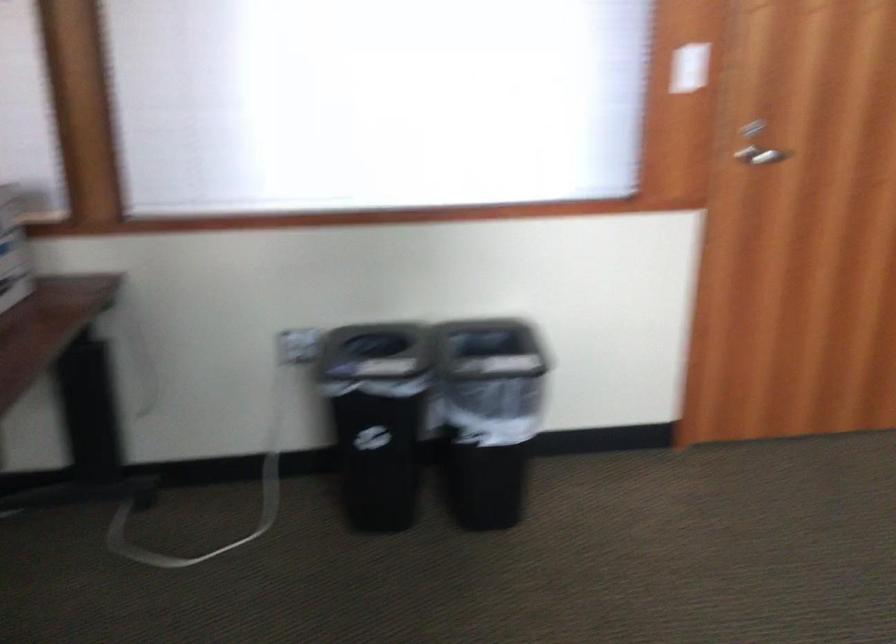
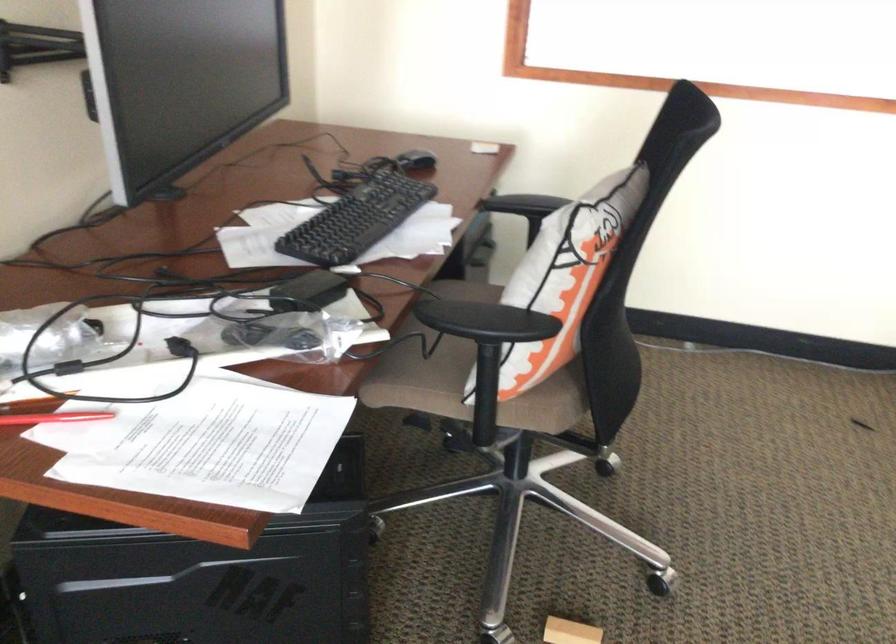
Question: Which direction would the cameraman need to move to produce the second image? Reply with the corresponding letter.

Choices:
 (A) Left
 (B) Right
 (C) Forward
 (D) Backward

Answer: (A)